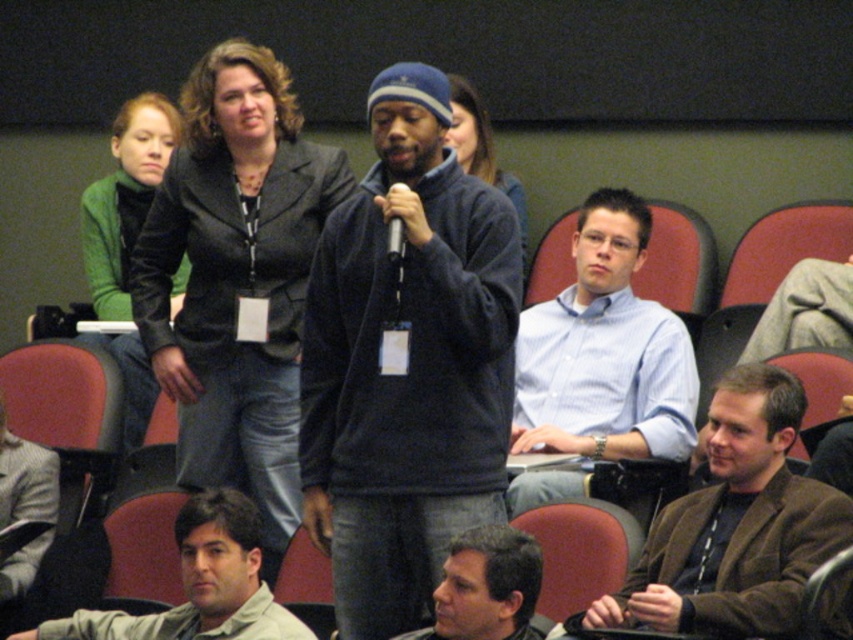
Question: From the image, what is the correct spatial relationship of dark gray blazer at upper center in relation to matte black jacket at center?

Choices:
 (A) left
 (B) right

Answer: (A)

Question: Can you confirm if dark gray blazer at upper center is smaller than black plastic microphone at center?

Choices:
 (A) no
 (B) yes

Answer: (A)

Question: Where is blue shirt at center located in relation to gray hair at lower center in the image?

Choices:
 (A) left
 (B) right

Answer: (B)

Question: Which of these objects is positioned farthest from the matte black jacket at center?

Choices:
 (A) brown leather jacket at lower right
 (B) dark gray blazer at upper center
 (C) gray wool sweater at lower left
 (D) gray hair at lower center

Answer: (C)

Question: Based on their relative distances, which object is nearer to the gray hair at lower center?

Choices:
 (A) brown leather jacket at lower right
 (B) light brown shirt at lower left
 (C) green fuzzy sweater at upper left
 (D) blue shirt at center

Answer: (A)

Question: Which point is farther from the camera taking this photo?

Choices:
 (A) (489, 179)
 (B) (357, 234)
 (C) (590, 435)

Answer: (A)